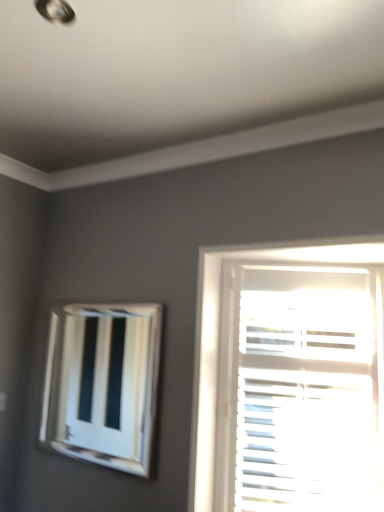
The image size is (384, 512). What do you see at coordinates (102, 383) in the screenshot?
I see `white glossy vent at upper left` at bounding box center [102, 383].

At what (x,y) coordinates should I click in order to perform the action: click on white glossy vent at upper left. Please return your answer as a coordinate pair (x, y). Looking at the image, I should click on (102, 383).

I want to click on white matte blinds at right, so click(218, 336).

What do you see at coordinates (218, 336) in the screenshot?
I see `white matte blinds at right` at bounding box center [218, 336].

Identify the location of white glossy vent at upper left. (102, 383).

Which object is positioned more to the left, white glossy vent at upper left or white matte blinds at right?

white glossy vent at upper left.

Is the depth of white glossy vent at upper left greater than that of white matte blinds at right?

Yes, white glossy vent at upper left is behind white matte blinds at right.

Which is in front, point (145, 361) or point (207, 257)?

The point (207, 257) is more forward.

From the image's perspective, would you say white glossy vent at upper left is positioned over white matte blinds at right?

Indeed, from the image's perspective, white glossy vent at upper left is shown above white matte blinds at right.

From a real-world perspective, between white glossy vent at upper left and white matte blinds at right, who is vertically lower?

From a 3D spatial view, white matte blinds at right is below.

Which object is thinner, white glossy vent at upper left or white matte blinds at right?

With smaller width is white glossy vent at upper left.

Is white glossy vent at upper left taller than white matte blinds at right?

No.

Between white glossy vent at upper left and white matte blinds at right, which one has larger size?

With larger size is white matte blinds at right.

Can we say white glossy vent at upper left lies outside white matte blinds at right?

white glossy vent at upper left lies outside white matte blinds at right's area.

Based on the photo, is white glossy vent at upper left not near white matte blinds at right?

Absolutely, white glossy vent at upper left is distant from white matte blinds at right.

Is white glossy vent at upper left positioned with its back to white matte blinds at right?

No, white glossy vent at upper left's orientation is not away from white matte blinds at right.

Measure the distance between white glossy vent at upper left and white matte blinds at right.

white glossy vent at upper left and white matte blinds at right are 1.56 meters apart from each other.

This screenshot has height=512, width=384. Find the location of `bay window behind the white matte blinds at right`. bay window behind the white matte blinds at right is located at coordinates (102, 383).

Is white matte blinds at right at the right side of white glossy vent at upper left?

Indeed, white matte blinds at right is positioned on the right side of white glossy vent at upper left.

Which object is closer to the camera, white matte blinds at right or white glossy vent at upper left?

white matte blinds at right is closer to the camera.

Is point (364, 247) closer or farther from the camera than point (104, 331)?

Clearly, point (364, 247) is closer to the camera than point (104, 331).

From the image's perspective, which one is positioned higher, white matte blinds at right or white glossy vent at upper left?

white glossy vent at upper left, from the image's perspective.

From a real-world perspective, who is located lower, white matte blinds at right or white glossy vent at upper left?

white matte blinds at right, from a real-world perspective.

Which object is thinner, white matte blinds at right or white glossy vent at upper left?

With smaller width is white glossy vent at upper left.

Can you confirm if white matte blinds at right is taller than white glossy vent at upper left?

Indeed, white matte blinds at right has a greater height compared to white glossy vent at upper left.

Considering the sizes of objects white matte blinds at right and white glossy vent at upper left in the image provided, who is bigger, white matte blinds at right or white glossy vent at upper left?

With larger size is white matte blinds at right.

Is white matte blinds at right outside of white glossy vent at upper left?

white matte blinds at right lies outside white glossy vent at upper left's area.

Would you say white matte blinds at right is a long distance from white glossy vent at upper left?

Absolutely, white matte blinds at right is distant from white glossy vent at upper left.

Could you tell me if white matte blinds at right is turned towards white glossy vent at upper left?

No, white matte blinds at right is not aimed at white glossy vent at upper left.

Can you tell me how much white matte blinds at right and white glossy vent at upper left differ in facing direction?

1.3 degrees separate the facing orientations of white matte blinds at right and white glossy vent at upper left.

Where is `window that appears in front of the white glossy vent at upper left`? The image size is (384, 512). window that appears in front of the white glossy vent at upper left is located at coordinates (218, 336).

I want to click on window in front of the white glossy vent at upper left, so click(x=218, y=336).

In order to click on bay window on the left of white matte blinds at right in this screenshot , I will do `click(102, 383)`.